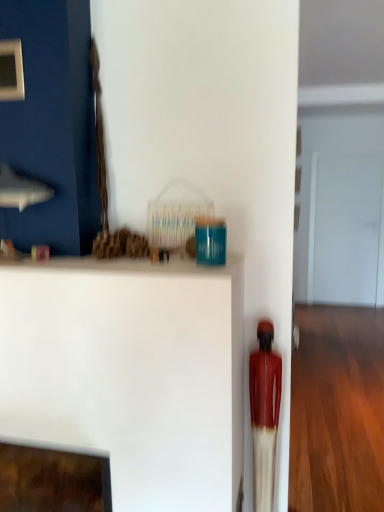
What is the approximate height of transparent glass door at center?

The height of transparent glass door at center is 2.03 meters.

Find the location of `matte red statue at right`. matte red statue at right is located at coordinates (264, 415).

Locate an element on the screen. Image resolution: width=384 pixels, height=512 pixels. transparent glass door at center is located at coordinates (346, 231).

From the image's perspective, is white matte shelf at center below transparent glass door at center?

Yes, from the image's perspective, white matte shelf at center is below transparent glass door at center.

Is white matte shelf at center facing towards transparent glass door at center?

No, white matte shelf at center is not oriented towards transparent glass door at center.

Relative to transparent glass door at center, is white matte shelf at center in front or behind?

white matte shelf at center is positioned closer to the viewer than transparent glass door at center.

Considering the positions of objects white matte shelf at center and transparent glass door at center in the image provided, who is more to the right, white matte shelf at center or transparent glass door at center?

transparent glass door at center.

Is white matte shelf at center not close to matte red statue at right?

white matte shelf at center is actually quite close to matte red statue at right.

Which is nearer, (21,378) or (251,355)?

Point (21,378) is positioned closer to the camera compared to point (251,355).

Consider the image. Is white matte shelf at center positioned before matte red statue at right?

Yes, it is.

Is white matte shelf at center located outside matte red statue at right?

That's correct, white matte shelf at center is outside of matte red statue at right.

The width and height of the screenshot is (384, 512). What are the coordinates of `toy behind the white matte shelf at center` in the screenshot? It's located at (264, 415).

Does matte red statue at right appear on the right side of white matte shelf at center?

Yes.

Is white matte shelf at center at the back of matte red statue at right?

No.

Between transparent glass door at center and matte red statue at right, which one appears on the right side from the viewer's perspective?

Positioned to the right is transparent glass door at center.

Is transparent glass door at center thinner than matte red statue at right?

Yes, transparent glass door at center is thinner than matte red statue at right.

Does point (319, 196) come closer to viewer compared to point (264, 430)?

No, it is behind (264, 430).

Would you say matte red statue at right is part of transparent glass door at center's contents?

No, transparent glass door at center does not contain matte red statue at right.

Can you confirm if transparent glass door at center is thinner than white matte shelf at center?

Yes, transparent glass door at center is thinner than white matte shelf at center.

From a real-world perspective, does transparent glass door at center stand above white matte shelf at center?

Yes, from a real-world perspective, transparent glass door at center is on top of white matte shelf at center.

Are transparent glass door at center and white matte shelf at center far apart?

Yes, transparent glass door at center and white matte shelf at center are quite far apart.

From the picture: How far apart are matte red statue at right and transparent glass door at center?

4.48 meters.

Between point (257, 506) and point (349, 224), which one is positioned behind?

The point (349, 224) is farther from the camera.

How many degrees apart are the facing directions of matte red statue at right and transparent glass door at center?

0.268 degrees.

Which of these two, matte red statue at right or transparent glass door at center, is thinner?

transparent glass door at center is thinner.

You are a GUI agent. You are given a task and a screenshot of the screen. Output one action in this format:
    pyautogui.click(x=<x>, y=<y>)
    Task: Click on the glass door above the white matte shelf at center (from a real-world perspective)
    This screenshot has width=384, height=512.
    Given the screenshot: What is the action you would take?
    pyautogui.click(x=346, y=231)

Find the location of a particular element. The height and width of the screenshot is (512, 384). furniture that appears on the left of matte red statue at right is located at coordinates (130, 373).

Based on their spatial positions, is white matte shelf at center or matte red statue at right closer to transparent glass door at center?

matte red statue at right is positioned closer to the anchor transparent glass door at center.

When comparing their distances from white matte shelf at center, does matte red statue at right or transparent glass door at center seem further?

transparent glass door at center.

Based on their spatial positions, is transparent glass door at center or matte red statue at right further from white matte shelf at center?

Based on the image, transparent glass door at center appears to be further to white matte shelf at center.

Looking at the image, which one is located closer to matte red statue at right, transparent glass door at center or white matte shelf at center?

white matte shelf at center lies closer to matte red statue at right than the other object.

From the image, which object appears to be nearer to matte red statue at right, white matte shelf at center or transparent glass door at center?

Among the two, white matte shelf at center is located nearer to matte red statue at right.

When comparing their distances from transparent glass door at center, does matte red statue at right or white matte shelf at center seem closer?

Among the two, matte red statue at right is located nearer to transparent glass door at center.

This screenshot has width=384, height=512. Find the location of `toy positioned between white matte shelf at center and transparent glass door at center from near to far`. toy positioned between white matte shelf at center and transparent glass door at center from near to far is located at coordinates (264, 415).